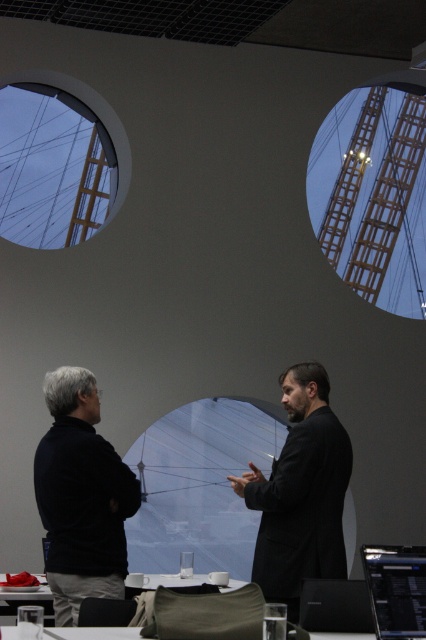
You are a delivery person who needs to place a package on the table between the black matte jacket at left and the black matte laptop at center. Which object should you move closer to you to make space?

The black matte jacket at left is closer to you than the black matte laptop at center. To make space, you should move the black matte jacket at left, which is nearer, to access the area near the laptop.

You are an interior designer assessing the placement of the black matte jacket at left and the black matte suit at center in the office scene. Which object is closer to the floor?

The black matte jacket at left is positioned under the black matte suit at center, so it is closer to the floor.